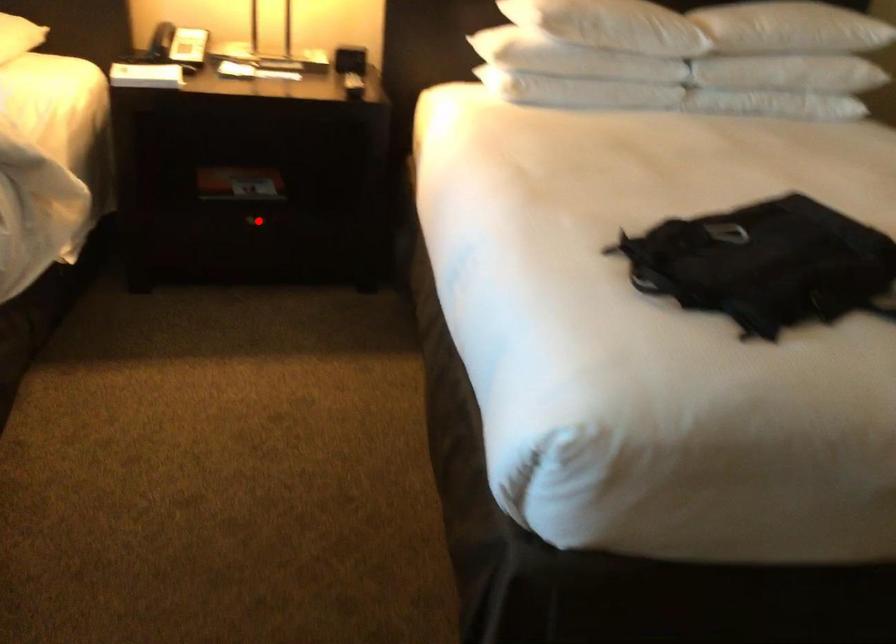
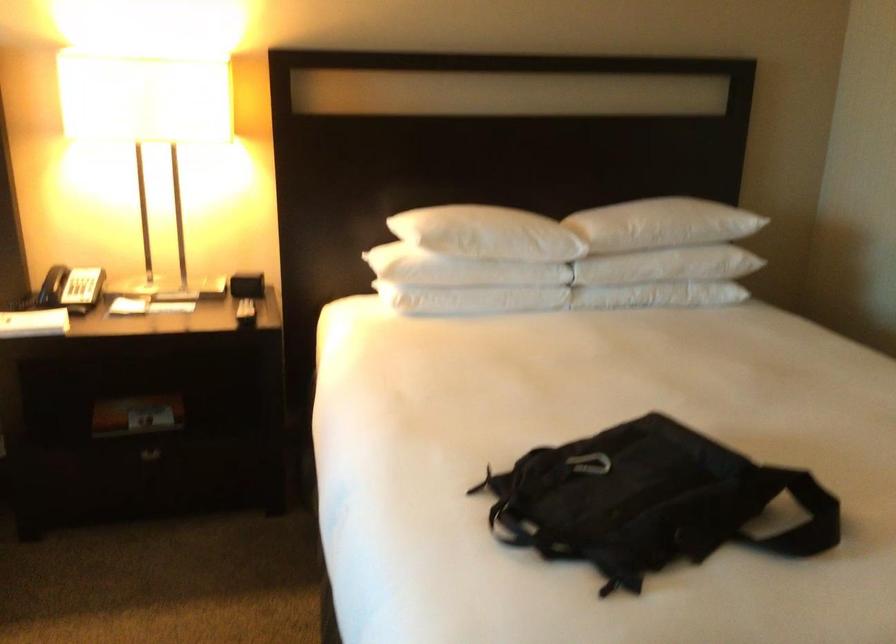
Locate, in the second image, the point that corresponds to the highlighted location in the first image.

(151, 456)